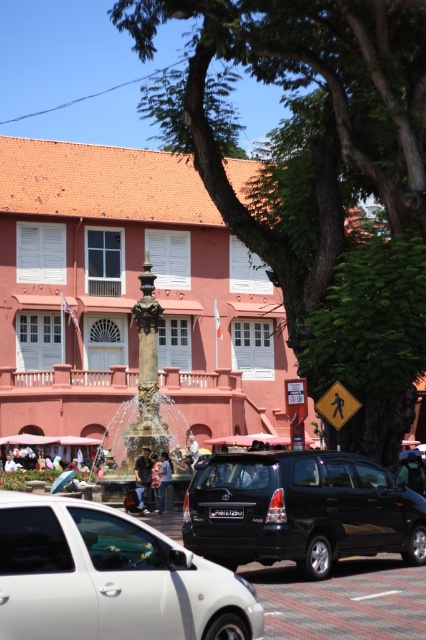
Is white matte car at center to the right of bronze ornate fountain at center from the viewer's perspective?

Indeed, white matte car at center is positioned on the right side of bronze ornate fountain at center.

Between white matte car at center and bronze ornate fountain at center, which one is positioned lower?

white matte car at center is below.

Who is more forward, [149,637] or [149,440]?

Point [149,637]

Locate an element on the screen. The width and height of the screenshot is (426, 640). white matte car at center is located at coordinates (109, 579).

Who is more forward, (252, 625) or (207, 547)?

Point (252, 625) is in front.

Does white matte car at center have a greater height compared to black matte suv at center?

No, white matte car at center is not taller than black matte suv at center.

Is point (143, 608) positioned behind point (224, 493)?

No, (143, 608) is closer to viewer.

At what (x,y) coordinates should I click in order to perform the action: click on white matte car at center. Please return your answer as a coordinate pair (x, y). Looking at the image, I should click on (109, 579).

Who is positioned more to the left, black matte suv at center or bronze ornate fountain at center?

From the viewer's perspective, bronze ornate fountain at center appears more on the left side.

Identify the location of black matte suv at center. (299, 509).